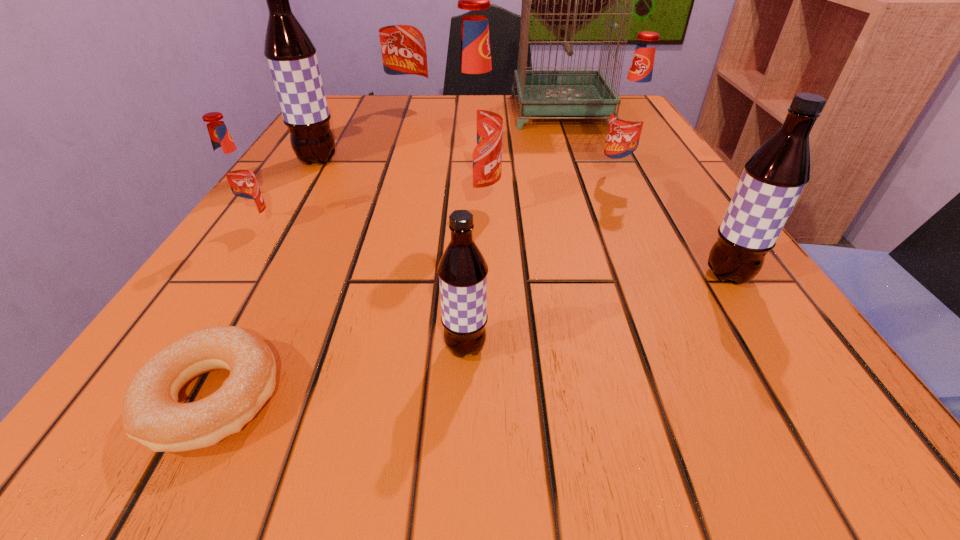
You are a GUI agent. You are given a task and a screenshot of the screen. Output one action in this format:
    pyautogui.click(x=<x>, y=<y>)
    Task: Click on the object that is the sixth nearest to the third smallest red root beer
    The image size is (960, 540).
    Given the screenshot: What is the action you would take?
    pyautogui.click(x=773, y=178)

Identify which object is the third nearest to the rightmost red root beer. Please provide its 2D coordinates. Your answer should be formatted as a tuple, i.e. [(x, y)], where the tuple contains the x and y coordinates of a point satisfying the conditions above.

[(773, 178)]

Select which root beer is the sixth closest to the birdcage. Please provide its 2D coordinates. Your answer should be formatted as a tuple, i.e. [(x, y)], where the tuple contains the x and y coordinates of a point satisfying the conditions above.

[(236, 179)]

Select which root beer is the second closest to the bagel. Please provide its 2D coordinates. Your answer should be formatted as a tuple, i.e. [(x, y)], where the tuple contains the x and y coordinates of a point satisfying the conditions above.

[(236, 179)]

Locate an element on the screen. red root beer that stands as the third closest to the biggest red root beer is located at coordinates (236, 179).

Choose which red root beer is the second nearest neighbor to the second farthest red root beer. Please provide its 2D coordinates. Your answer should be formatted as a tuple, i.e. [(x, y)], where the tuple contains the x and y coordinates of a point satisfying the conditions above.

[(401, 27)]

Where is `brown root beer that is the closest to the biggest red root beer`? The width and height of the screenshot is (960, 540). brown root beer that is the closest to the biggest red root beer is located at coordinates (291, 56).

Choose which brown root beer is the second nearest neighbor to the second biggest red root beer. Please provide its 2D coordinates. Your answer should be formatted as a tuple, i.e. [(x, y)], where the tuple contains the x and y coordinates of a point satisfying the conditions above.

[(291, 56)]

Locate an element on the screen. vacant region that satisfies the following two spatial constraints: 1. on the back side of the shortest object; 2. on the left side of the second red root beer from right to left is located at coordinates (314, 207).

Where is `free spot that satisfies the following two spatial constraints: 1. on the front side of the nearest root beer; 2. on the right side of the tallest root beer`? free spot that satisfies the following two spatial constraints: 1. on the front side of the nearest root beer; 2. on the right side of the tallest root beer is located at coordinates click(335, 348).